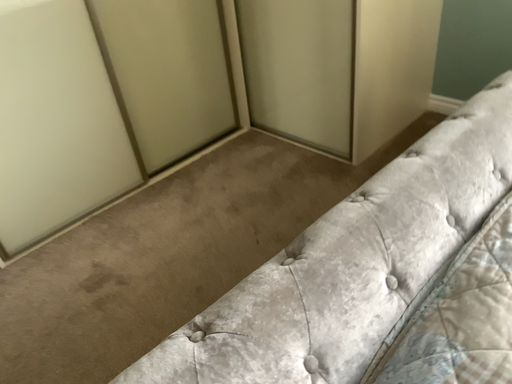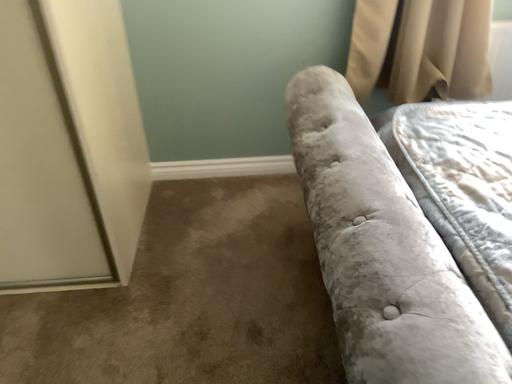
Question: Which way did the camera rotate in the video?

Choices:
 (A) rotated downward
 (B) rotated upward

Answer: (B)